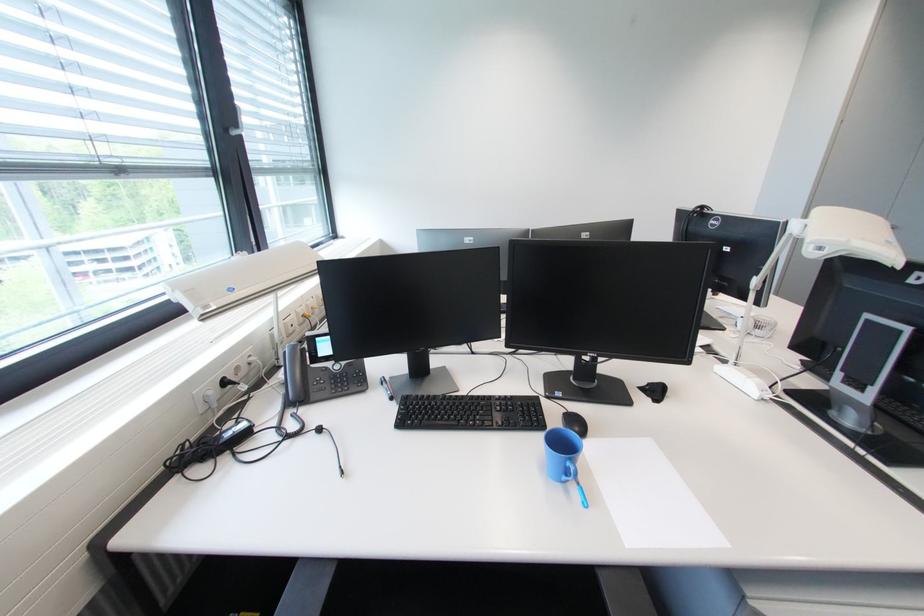
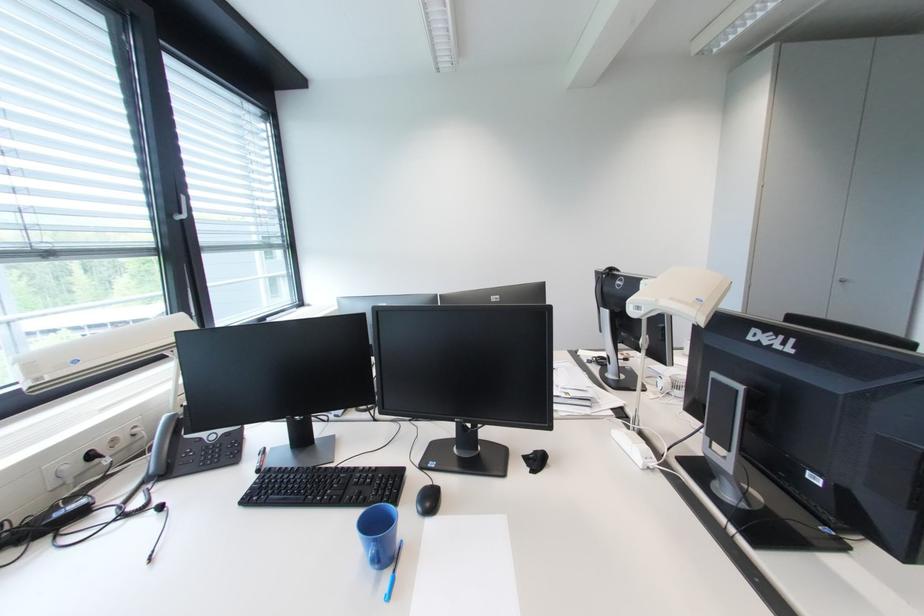
In the second image, find the point that corresponds to [573,411] in the first image.

(438, 485)